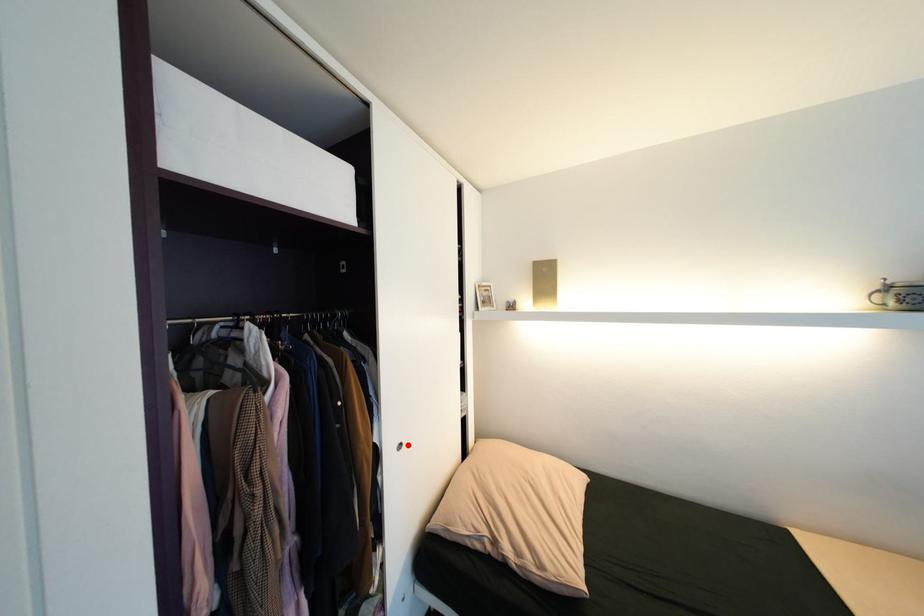
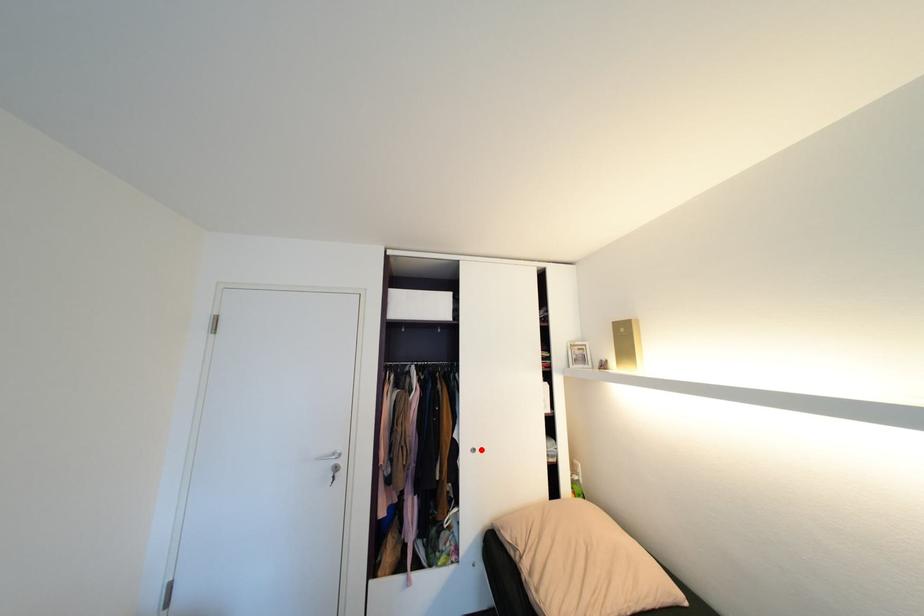
I am providing you with two images of the same scene from different viewpoints. A red point is marked on the first image and another point is marked on the second image. Are the points marked in image1 and image2 representing the same 3D position?

Yes